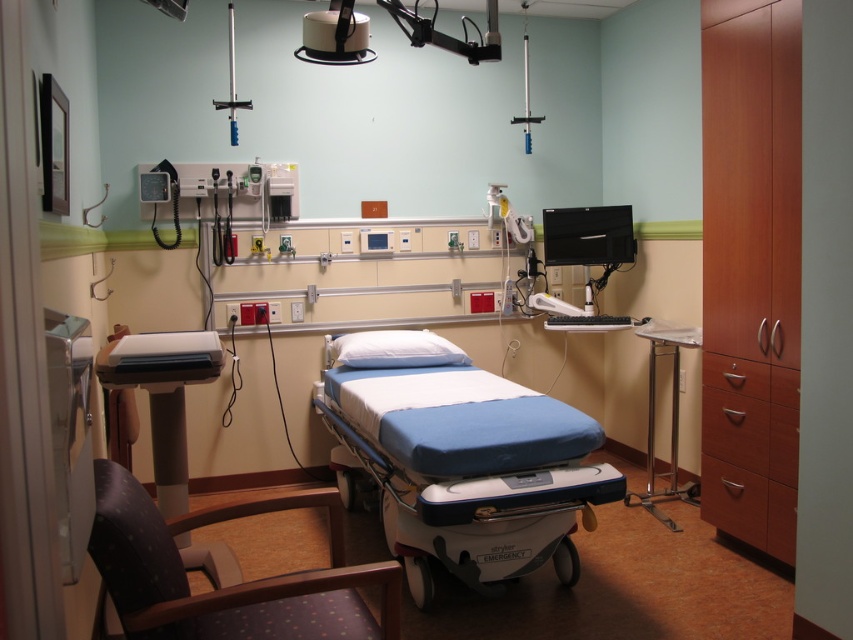
Is brown wood drawer at right positioned behind satin silver monitor at upper right?

No.

Is point (705, 410) more distant than point (621, 326)?

No, it is in front of (621, 326).

I want to click on brown wood drawer at right, so click(749, 452).

Identify the location of brown wood drawer at right. The image size is (853, 640). tap(749, 452).

Is point (708, 376) less distant than point (682, 499)?

Yes.

Locate an element on the screen. The image size is (853, 640). brown wood drawer at right is located at coordinates (749, 452).

Consider the image. Does blue fabric bed at center have a lesser width compared to wooden drawer at lower right?

In fact, blue fabric bed at center might be wider than wooden drawer at lower right.

Which of these two, blue fabric bed at center or wooden drawer at lower right, stands taller?

Standing taller between the two is blue fabric bed at center.

The height and width of the screenshot is (640, 853). Describe the element at coordinates (462, 460) in the screenshot. I see `blue fabric bed at center` at that location.

Where is `blue fabric bed at center`? blue fabric bed at center is located at coordinates (462, 460).